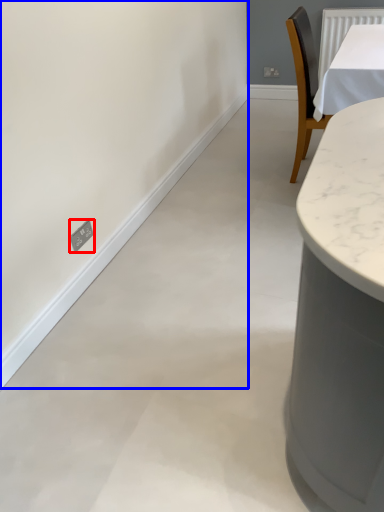
Question: Which of the following is the farthest to the observer, electric outlet (highlighted by a red box) or backdrop (highlighted by a blue box)?

Choices:
 (A) electric outlet
 (B) backdrop

Answer: (A)